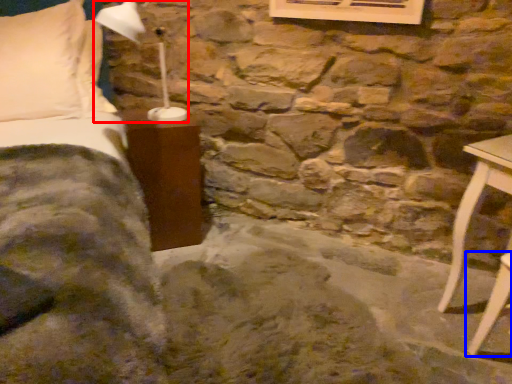
Question: Which point is closer to the camera, table lamp (highlighted by a red box) or furniture (highlighted by a blue box)?

Choices:
 (A) table lamp
 (B) furniture

Answer: (B)